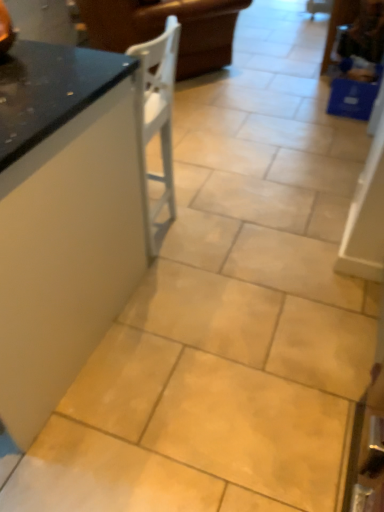
The height and width of the screenshot is (512, 384). In order to click on free space in front of white wood chair at upper left in this screenshot , I will do `click(220, 118)`.